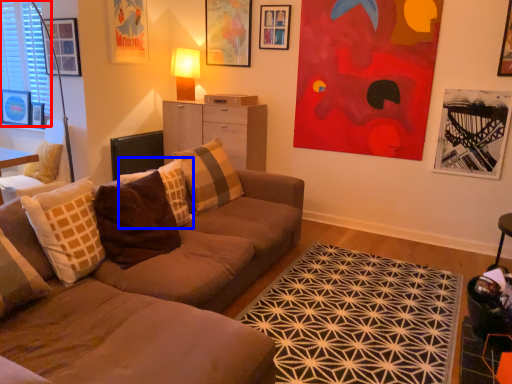
Question: Which of the following is the closest to the observer, window (highlighted by a red box) or pillow (highlighted by a blue box)?

Choices:
 (A) window
 (B) pillow

Answer: (B)